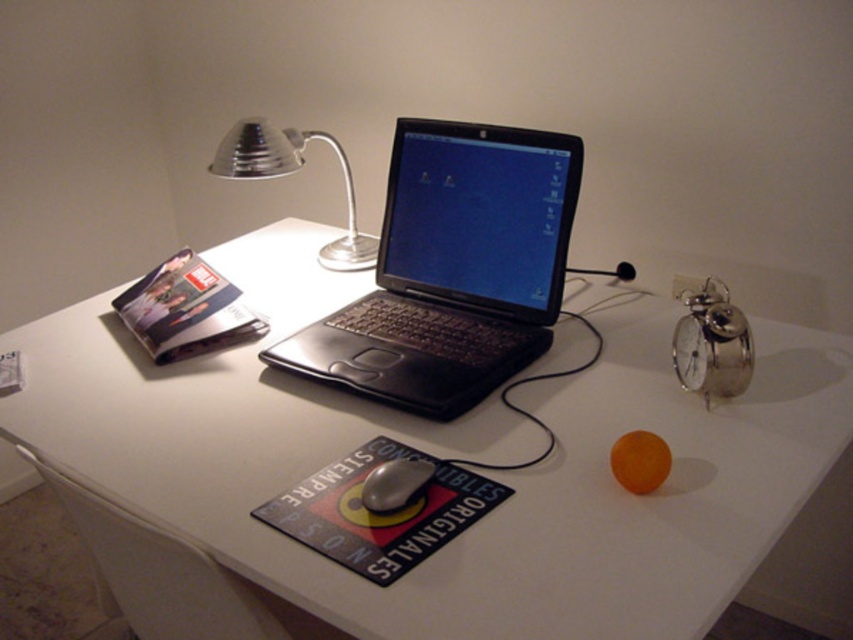
Question: Which object is positioned closest to the silver metallic alarm clock at upper right?

Choices:
 (A) black rubber mouse at center
 (B) satin silver desk lamp at upper center

Answer: (A)

Question: Which point appears closest to the camera in this image?

Choices:
 (A) (577, 141)
 (B) (386, 492)

Answer: (B)

Question: Is black matte laptop at center positioned in front of satin silver desk lamp at upper center?

Choices:
 (A) no
 (B) yes

Answer: (B)

Question: Can you confirm if white glossy table at center is smaller than black matte laptop at center?

Choices:
 (A) no
 (B) yes

Answer: (A)

Question: Which is farther from the black matte laptop at center?

Choices:
 (A) silver metallic alarm clock at upper right
 (B) black rubber mouse at center
 (C) white glossy table at center

Answer: (B)

Question: Is silver metallic alarm clock at upper right below black rubber mouse at center?

Choices:
 (A) yes
 (B) no

Answer: (B)